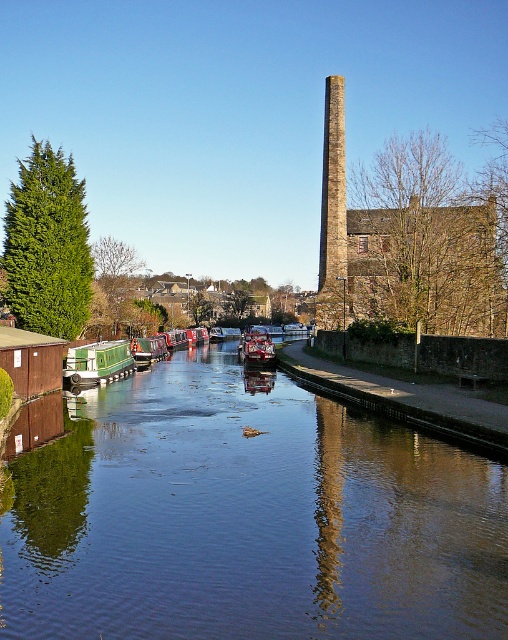
Question: Can you confirm if smooth dark water at center is positioned to the left of green painted wooden canal boat at left?

Choices:
 (A) yes
 (B) no

Answer: (B)

Question: Which of the following is the closest to the observer?

Choices:
 (A) (252, 332)
 (B) (123, 368)
 (C) (331, 595)
 (D) (327, 243)

Answer: (C)

Question: Does rustic stone chimney at center appear under metallic red boat at center?

Choices:
 (A) no
 (B) yes

Answer: (A)

Question: Can you confirm if smooth dark water at center is wider than rustic stone chimney at center?

Choices:
 (A) no
 (B) yes

Answer: (B)

Question: Estimate the real-world distances between objects in this image. Which object is closer to the metallic red boat at center?

Choices:
 (A) smooth dark water at center
 (B) green painted wooden canal boat at left
 (C) rustic stone chimney at center

Answer: (C)

Question: Which object is the farthest from the rustic stone chimney at center?

Choices:
 (A) green painted wooden canal boat at left
 (B) metallic red boat at center
 (C) smooth dark water at center

Answer: (C)